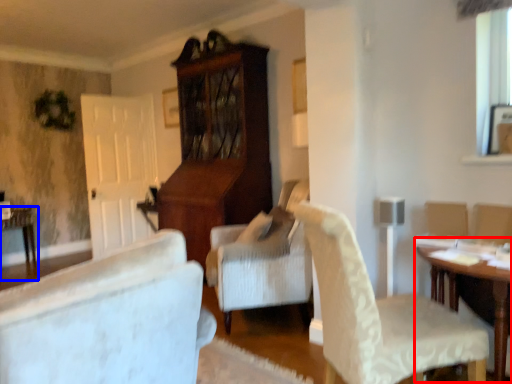
Question: Which object is further to the camera taking this photo, table (highlighted by a red box) or table (highlighted by a blue box)?

Choices:
 (A) table
 (B) table

Answer: (B)